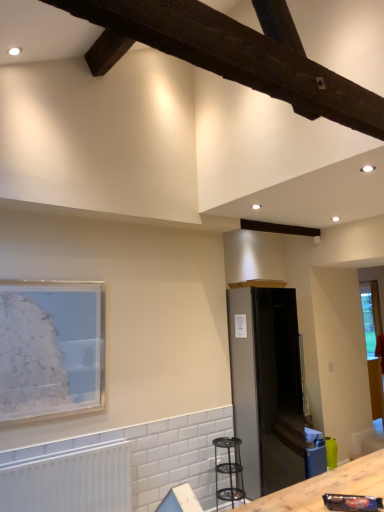
Question: Looking at their shapes, would you say matte glass picture frame at left is wider or thinner than white matte radiator at lower left?

Choices:
 (A) thin
 (B) wide

Answer: (A)

Question: Does point click(16, 380) appear closer or farther from the camera than point click(46, 478)?

Choices:
 (A) closer
 (B) farther

Answer: (B)

Question: Which is nearer to the metallic black stool at lower center?

Choices:
 (A) matte glass picture frame at left
 (B) white matte radiator at lower left
 (C) satin black refrigerator at center
 (D) dark brown wood at upper center

Answer: (C)

Question: Considering the real-world distances, which object is closest to the white matte radiator at lower left?

Choices:
 (A) metallic black stool at lower center
 (B) dark brown wood at upper center
 (C) matte glass picture frame at left
 (D) satin black refrigerator at center

Answer: (C)